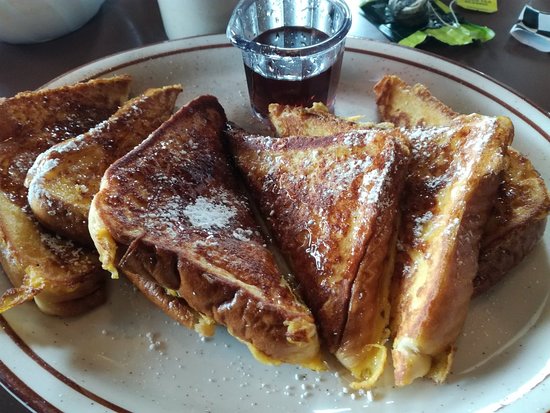
Locate an element on the screen. Image resolution: width=550 pixels, height=413 pixels. table is located at coordinates (529, 65).